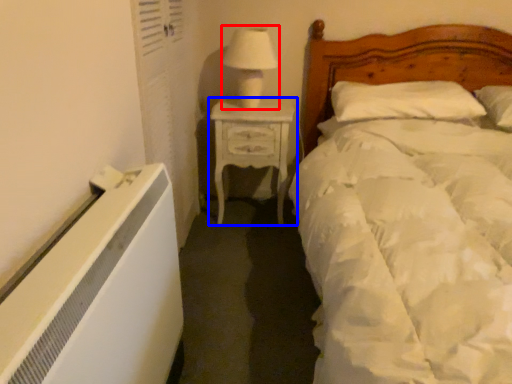
Question: Which of the following is the farthest to the observer, table lamp (highlighted by a red box) or nightstand (highlighted by a blue box)?

Choices:
 (A) table lamp
 (B) nightstand

Answer: (B)